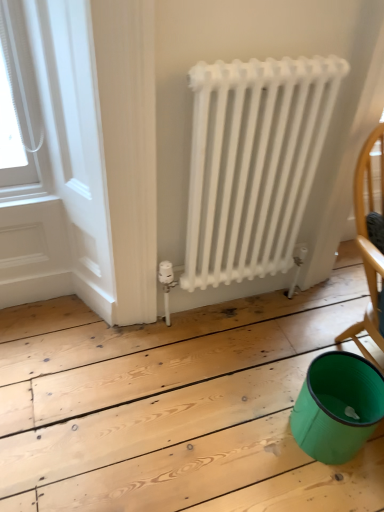
Question: Is teal plastic bucket at lower right spatially inside white painted wood at upper left, or outside of it?

Choices:
 (A) inside
 (B) outside

Answer: (B)

Question: Is point (301, 416) positioned closer to the camera than point (46, 206)?

Choices:
 (A) farther
 (B) closer

Answer: (B)

Question: Which object is the closest to the white matte radiator at center?

Choices:
 (A) wooden chair at right
 (B) teal plastic bucket at lower right
 (C) white painted wood at upper left

Answer: (A)

Question: Considering the real-world distances, which object is closest to the teal plastic bucket at lower right?

Choices:
 (A) white painted wood at upper left
 (B) white matte radiator at center
 (C) wooden chair at right

Answer: (C)